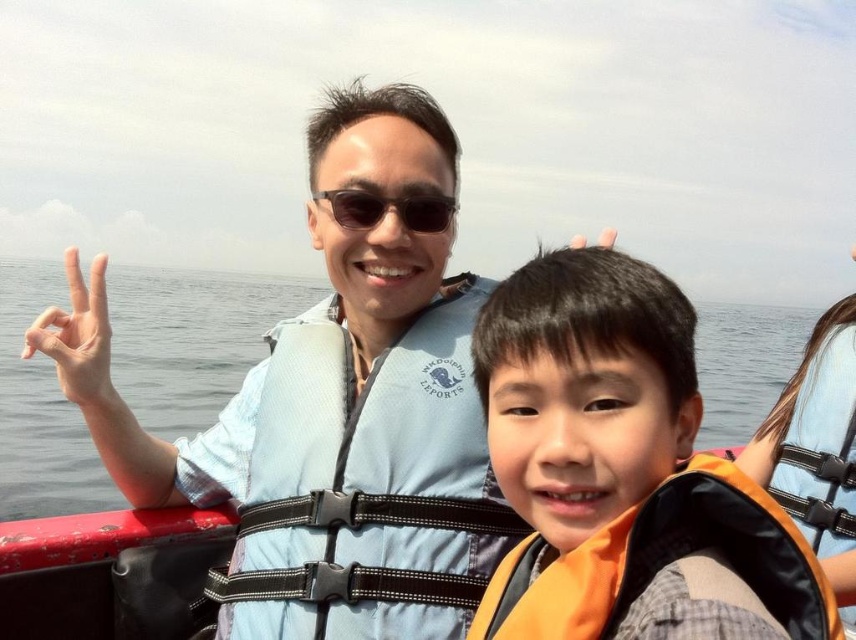
Question: Does orange life vest at center have a larger size compared to light blue life vest at right?

Choices:
 (A) no
 (B) yes

Answer: (A)

Question: Which point is closer to the camera?

Choices:
 (A) transparent water at center
 (B) blue life vest at center

Answer: (B)

Question: Does blue mesh life jacket at center have a lesser width compared to orange fabric life jacket at lower right?

Choices:
 (A) yes
 (B) no

Answer: (B)

Question: Does orange life vest at center lie in front of sunglasses at center?

Choices:
 (A) no
 (B) yes

Answer: (B)

Question: Among these objects, which one is farthest from the camera?

Choices:
 (A) orange fabric life jacket at lower right
 (B) white matte hand at left
 (C) blue life vest at center

Answer: (B)

Question: Which of the following is the farthest from the observer?

Choices:
 (A) (586, 304)
 (B) (393, 387)
 (C) (99, 394)

Answer: (C)